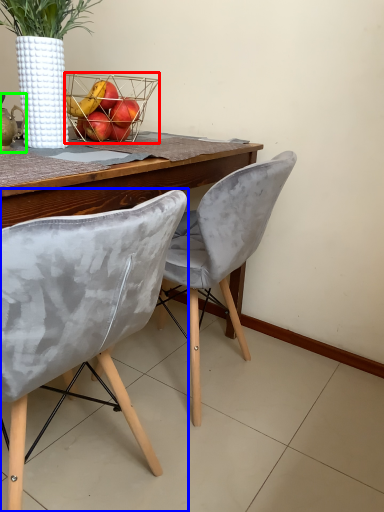
Question: Considering the real-world distances, which object is farthest from basket (highlighted by a red box)? chair (highlighted by a blue box) or tea pot (highlighted by a green box)?

Choices:
 (A) chair
 (B) tea pot

Answer: (A)